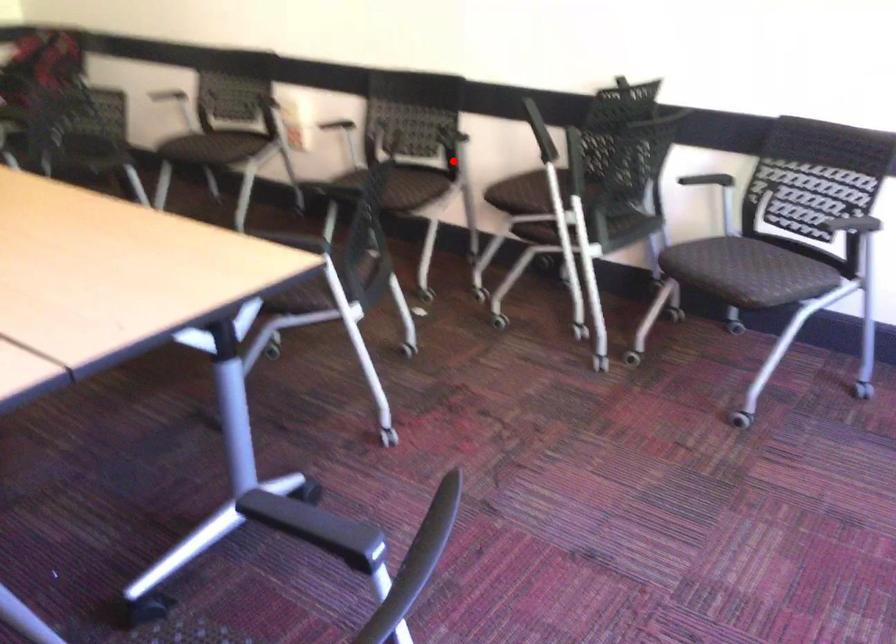
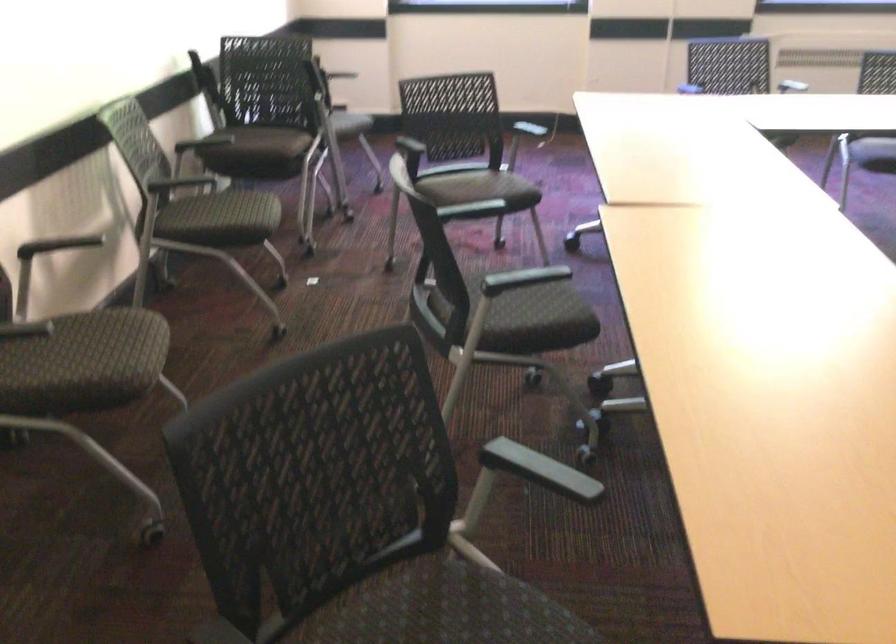
Find the pixel in the second image that matches the highlighted location in the first image.

(168, 187)